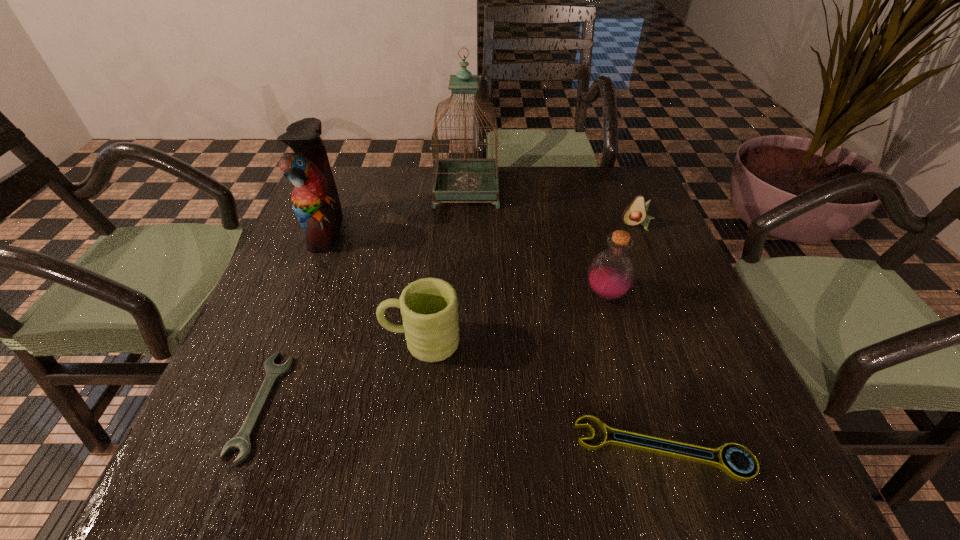
In the image, there is a desktop. At what (x,y) coordinates should I click in order to perform the action: click on vacant space at the right edge. Please return your answer as a coordinate pair (x, y). Looking at the image, I should click on (611, 218).

Where is `free region at the near left corner of the desktop`? This screenshot has width=960, height=540. free region at the near left corner of the desktop is located at coordinates (216, 442).

Locate an element on the screen. This screenshot has height=540, width=960. blank space at the far right corner is located at coordinates (604, 168).

Find the location of a particular element. The width and height of the screenshot is (960, 540). free space at the near right corner of the desktop is located at coordinates (711, 478).

Where is `vacant space in between the fourth shortest object and the right wrench`? vacant space in between the fourth shortest object and the right wrench is located at coordinates (542, 395).

Where is `free point between the tallest object and the mug`? This screenshot has height=540, width=960. free point between the tallest object and the mug is located at coordinates (444, 266).

Locate an element on the screen. The width and height of the screenshot is (960, 540). free area in between the fourth shortest object and the left wrench is located at coordinates (342, 373).

Locate an element on the screen. This screenshot has height=540, width=960. vacant space that is in between the third shortest object and the mug is located at coordinates (x=529, y=284).

At what (x,y) coordinates should I click in order to perform the action: click on free space between the right wrench and the bottle. Please return your answer as a coordinate pair (x, y). The image size is (960, 540). Looking at the image, I should click on (635, 372).

Locate an element on the screen. unoccupied area between the fourth farthest object and the right wrench is located at coordinates (635, 372).